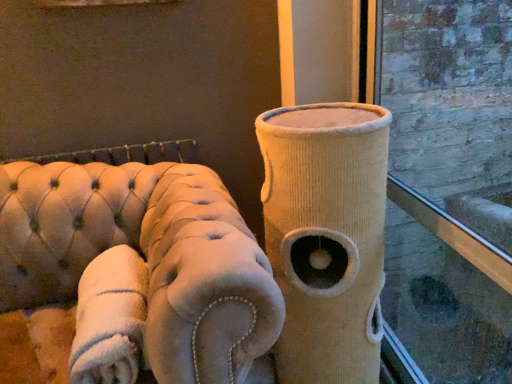
What do you see at coordinates (326, 237) in the screenshot?
I see `beige corduroy cat tower at center` at bounding box center [326, 237].

Locate an element on the screen. The image size is (512, 384). beige corduroy cat tower at center is located at coordinates (326, 237).

What is the approximate width of beige tufted sofa at left?

It is 34.85 inches.

The height and width of the screenshot is (384, 512). What do you see at coordinates (139, 269) in the screenshot?
I see `beige tufted sofa at left` at bounding box center [139, 269].

What is the approximate height of white plush blanket at lower left?

white plush blanket at lower left is 13.95 centimeters in height.

Locate an element on the screen. The image size is (512, 384). beige corduroy cat tower at center is located at coordinates (326, 237).

Is white plush blanket at lower left at the back of beige tufted sofa at left?

Absolutely, beige tufted sofa at left is directed away from white plush blanket at lower left.

From a real-world perspective, who is located higher, beige tufted sofa at left or white plush blanket at lower left?

white plush blanket at lower left.

The height and width of the screenshot is (384, 512). I want to click on cloth located above the beige tufted sofa at left (from the image's perspective), so click(x=110, y=319).

Between beige tufted sofa at left and white plush blanket at lower left, which one appears on the right side from the viewer's perspective?

white plush blanket at lower left.

Identify the location of furniture below the white plush blanket at lower left (from a real-world perspective). (x=139, y=269).

Is white plush blanket at lower left not within beige tufted sofa at left?

No, most part of white plush blanket at lower left lies within beige tufted sofa at left.

Looking at this image, does white plush blanket at lower left have a lesser height compared to beige tufted sofa at left?

Yes.

This screenshot has width=512, height=384. Identify the location of vase below the white plush blanket at lower left (from a real-world perspective). (326, 237).

Considering the sizes of objects white plush blanket at lower left and beige corduroy cat tower at center in the image provided, who is taller, white plush blanket at lower left or beige corduroy cat tower at center?

Standing taller between the two is beige corduroy cat tower at center.

Considering the relative sizes of white plush blanket at lower left and beige corduroy cat tower at center in the image provided, is white plush blanket at lower left smaller than beige corduroy cat tower at center?

Indeed, white plush blanket at lower left has a smaller size compared to beige corduroy cat tower at center.

Between beige corduroy cat tower at center and beige tufted sofa at left, which one appears on the left side from the viewer's perspective?

beige tufted sofa at left is more to the left.

Is beige corduroy cat tower at center in front of or behind beige tufted sofa at left in the image?

beige corduroy cat tower at center is behind beige tufted sofa at left.

Is beige corduroy cat tower at center turned away from beige tufted sofa at left?

beige corduroy cat tower at center does not have its back to beige tufted sofa at left.

Based on their sizes in the image, would you say beige corduroy cat tower at center is bigger or smaller than beige tufted sofa at left?

beige corduroy cat tower at center is smaller than beige tufted sofa at left.

Considering the positions of point (122, 273) and point (288, 211), is point (122, 273) closer or farther from the camera than point (288, 211)?

Clearly, point (122, 273) is closer to the camera than point (288, 211).

Can you confirm if beige tufted sofa at left is positioned to the right of beige corduroy cat tower at center?

No, beige tufted sofa at left is not to the right of beige corduroy cat tower at center.

Is beige tufted sofa at left wider than beige corduroy cat tower at center?

Yes.

Is beige tufted sofa at left bigger than beige corduroy cat tower at center?

Correct, beige tufted sofa at left is larger in size than beige corduroy cat tower at center.

Based on the photo, how different are the orientations of beige corduroy cat tower at center and white plush blanket at lower left in degrees?

81 degrees separate the facing orientations of beige corduroy cat tower at center and white plush blanket at lower left.

Does beige corduroy cat tower at center come in front of white plush blanket at lower left?

No, the depth of beige corduroy cat tower at center is greater than that of white plush blanket at lower left.

From a real-world perspective, is beige corduroy cat tower at center over white plush blanket at lower left?

No, from a real-world perspective, beige corduroy cat tower at center is not on top of white plush blanket at lower left.

From the image's perspective, between beige corduroy cat tower at center and white plush blanket at lower left, which one is located above?

beige corduroy cat tower at center is shown above in the image.

The height and width of the screenshot is (384, 512). Find the location of `cloth lying on the right of beige tufted sofa at left`. cloth lying on the right of beige tufted sofa at left is located at coordinates (x=110, y=319).

In the image, there is a white plush blanket at lower left. Where is `furniture below it (from the image's perspective)`? furniture below it (from the image's perspective) is located at coordinates (139, 269).

From the image, which object appears to be nearer to white plush blanket at lower left, beige tufted sofa at left or beige corduroy cat tower at center?

Based on the image, beige tufted sofa at left appears to be nearer to white plush blanket at lower left.

When comparing their distances from beige corduroy cat tower at center, does beige tufted sofa at left or white plush blanket at lower left seem closer?

Based on the image, beige tufted sofa at left appears to be nearer to beige corduroy cat tower at center.

Looking at this image, which object lies nearer to the anchor point beige corduroy cat tower at center, white plush blanket at lower left or beige tufted sofa at left?

beige tufted sofa at left is closer to beige corduroy cat tower at center.

From the image, which object appears to be farther from beige tufted sofa at left, beige corduroy cat tower at center or white plush blanket at lower left?

Among the two, beige corduroy cat tower at center is located further to beige tufted sofa at left.

Which object lies further to the anchor point beige tufted sofa at left, white plush blanket at lower left or beige corduroy cat tower at center?

Based on the image, beige corduroy cat tower at center appears to be further to beige tufted sofa at left.

Estimate the real-world distances between objects in this image. Which object is closer to white plush blanket at lower left, beige corduroy cat tower at center or beige tufted sofa at left?

beige tufted sofa at left.

Image resolution: width=512 pixels, height=384 pixels. What are the coordinates of `cloth between beige tufted sofa at left and beige corduroy cat tower at center from left to right` in the screenshot? It's located at (110, 319).